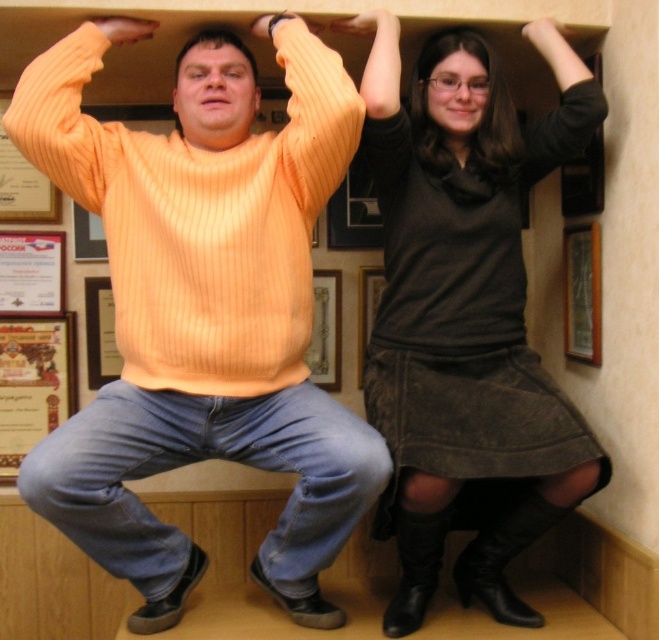
The width and height of the screenshot is (659, 640). What do you see at coordinates (204, 308) in the screenshot?
I see `orange ribbed sweater at center` at bounding box center [204, 308].

Who is lower down, orange ribbed sweater at center or dark brown suede skirt at upper right?

Positioned lower is orange ribbed sweater at center.

Who is more forward, (x=146, y=381) or (x=540, y=432)?

Point (x=540, y=432) is more forward.

I want to click on orange ribbed sweater at center, so click(204, 308).

Can you confirm if dark brown suede skirt at upper right is positioned to the right of wooden framed poster at left?

Indeed, dark brown suede skirt at upper right is positioned on the right side of wooden framed poster at left.

Is the position of dark brown suede skirt at upper right less distant than that of wooden framed poster at left?

Yes, dark brown suede skirt at upper right is closer to the viewer.

Describe the element at coordinates (465, 310) in the screenshot. I see `dark brown suede skirt at upper right` at that location.

Where is `dark brown suede skirt at upper right`? Image resolution: width=659 pixels, height=640 pixels. dark brown suede skirt at upper right is located at coordinates (465, 310).

Is dark brown suede skirt at upper right wider than matte black hair at upper center?

Yes.

Does dark brown suede skirt at upper right have a larger size compared to matte black hair at upper center?

Indeed, dark brown suede skirt at upper right has a larger size compared to matte black hair at upper center.

What do you see at coordinates (465, 310) in the screenshot? The image size is (659, 640). I see `dark brown suede skirt at upper right` at bounding box center [465, 310].

This screenshot has height=640, width=659. Find the location of `dark brown suede skirt at upper right`. dark brown suede skirt at upper right is located at coordinates pyautogui.click(x=465, y=310).